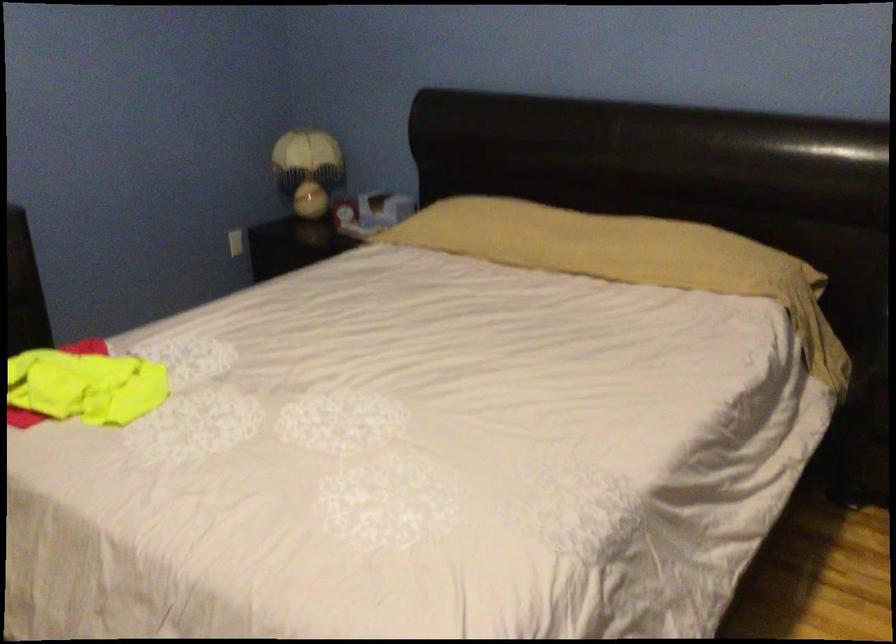
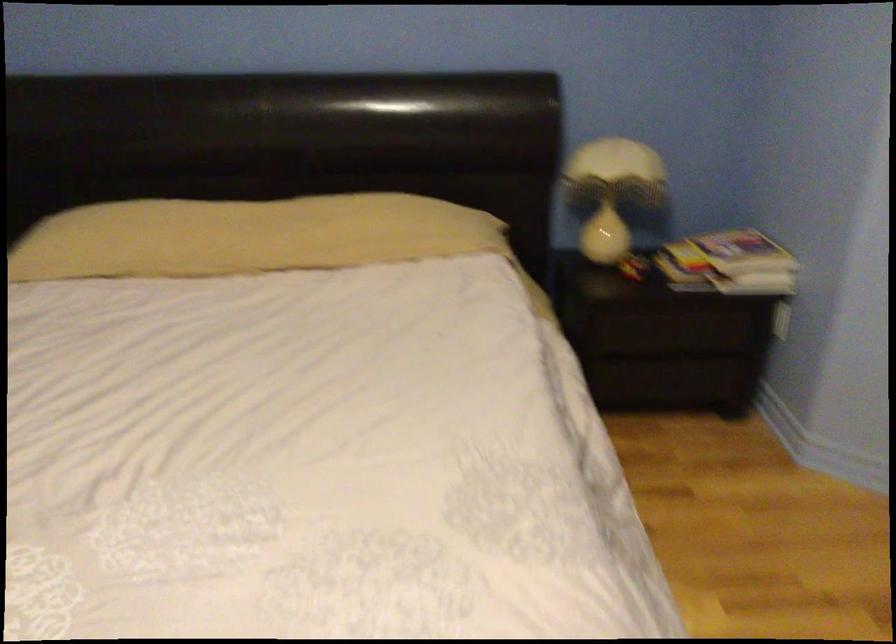
Question: The camera is either moving clockwise (left) or counter-clockwise (right) around the object. The first image is from the beginning of the video and the second image is from the end. Is the camera moving left or right when shooting the video?

Choices:
 (A) Left
 (B) Right

Answer: (A)